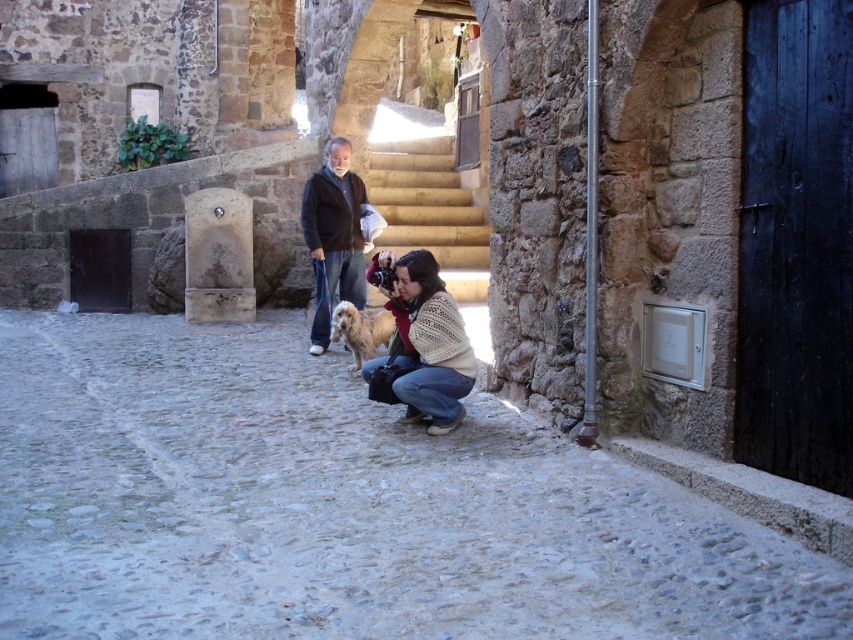
Question: Does yellow stone stairs at center appear over golden fur dog at center?

Choices:
 (A) yes
 (B) no

Answer: (A)

Question: Is yellow stone stairs at center below white knitted sweater at center?

Choices:
 (A) no
 (B) yes

Answer: (A)

Question: Which object appears closest to the camera in this image?

Choices:
 (A) yellow stone stairs at center
 (B) white knitted sweater at center
 (C) smooth stone alley at center
 (D) golden fur dog at center

Answer: (B)

Question: Which object is closer to the camera taking this photo?

Choices:
 (A) dark brown jacket at center
 (B) golden fur dog at center
 (C) yellow stone stairs at center
 (D) white knitted sweater at center

Answer: (D)

Question: Which object is positioned closest to the dark brown jacket at center?

Choices:
 (A) white knitted sweater at center
 (B) golden fur dog at center

Answer: (B)

Question: Does dark brown jacket at center have a larger size compared to golden fur dog at center?

Choices:
 (A) no
 (B) yes

Answer: (B)